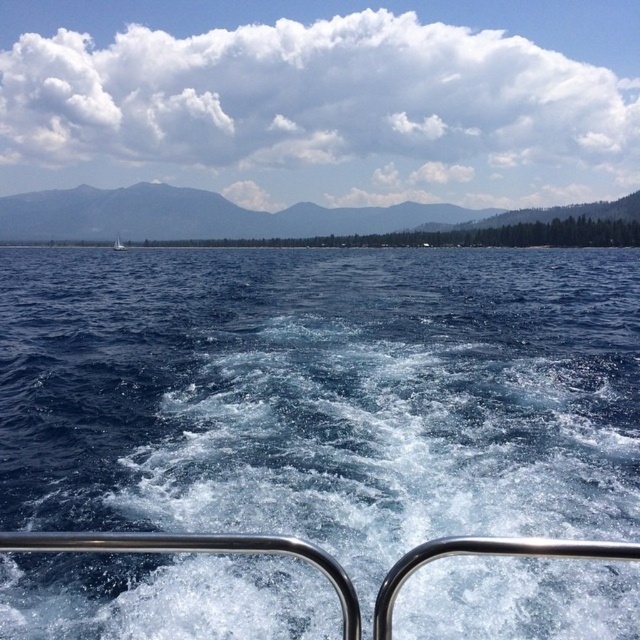
Consider the image. Can you confirm if blue liquid water at center is taller than white sailboat at left?

In fact, blue liquid water at center may be shorter than white sailboat at left.

Which is in front, point (390, 465) or point (116, 241)?

Positioned in front is point (390, 465).

The width and height of the screenshot is (640, 640). Describe the element at coordinates (321, 394) in the screenshot. I see `blue liquid water at center` at that location.

Image resolution: width=640 pixels, height=640 pixels. What are the coordinates of `blue liquid water at center` in the screenshot? It's located at (321, 394).

Is green forested mountain at upper center shorter than white sailboat at left?

No.

Is green forested mountain at upper center bigger than white sailboat at left?

Correct, green forested mountain at upper center is larger in size than white sailboat at left.

Describe the element at coordinates (244, 216) in the screenshot. I see `green forested mountain at upper center` at that location.

This screenshot has height=640, width=640. I want to click on green forested mountain at upper center, so click(244, 216).

Is blue liquid water at center to the left of green forested mountain at upper center from the viewer's perspective?

No, blue liquid water at center is not to the left of green forested mountain at upper center.

Does blue liquid water at center lie in front of green forested mountain at upper center?

Yes, it is in front of green forested mountain at upper center.

Between point (282, 513) and point (280, 216), which one is positioned behind?

Positioned behind is point (280, 216).

Locate an element on the screen. This screenshot has height=640, width=640. blue liquid water at center is located at coordinates (321, 394).